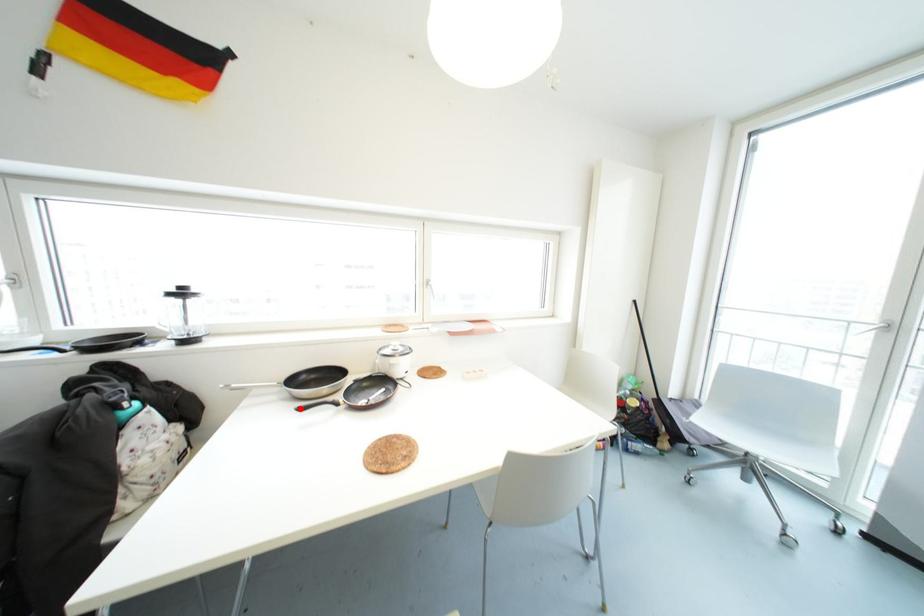
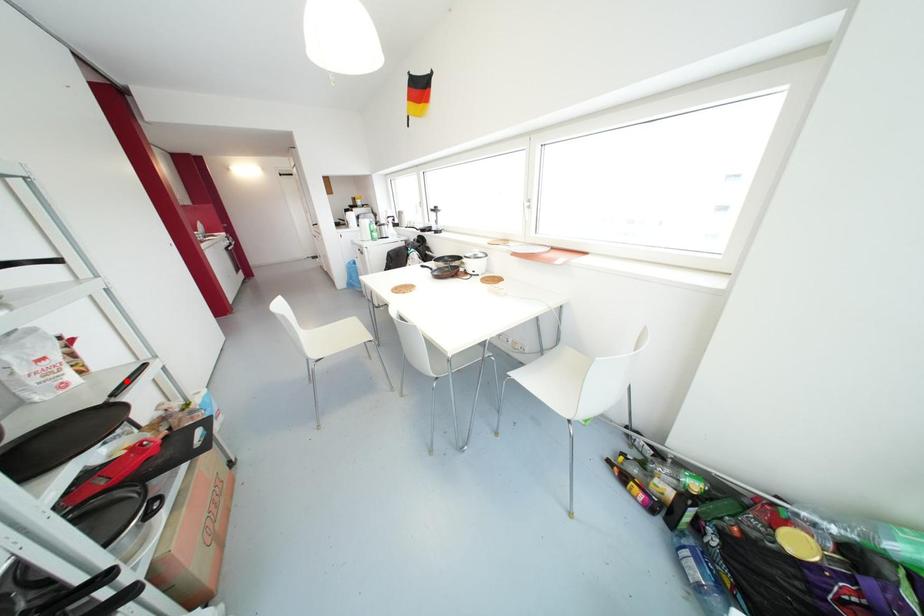
I am providing you with two images of the same scene from different viewpoints. A red point is marked on the first image and another point is marked on the second image. Are the points marked in image1 and image2 representing the same 3D position?

No